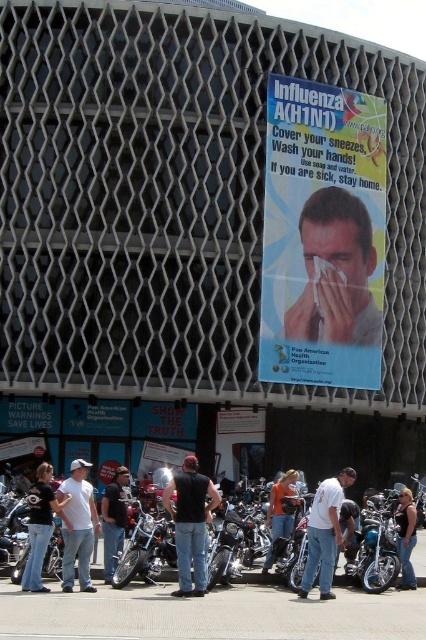
Between white cotton shirt at lower left and denim jeans at lower right, which one appears on the right side from the viewer's perspective?

denim jeans at lower right

Is white cotton shirt at lower left below denim jeans at lower right?

Incorrect, white cotton shirt at lower left is not positioned below denim jeans at lower right.

Is point (91, 544) positioned after point (399, 582)?

No, (91, 544) is closer to viewer.

This screenshot has height=640, width=426. I want to click on white cotton shirt at lower left, so click(77, 525).

Can you confirm if smooth skin face at center is thinner than denim jeans at lower right?

No.

Who is more forward, (333, 232) or (408, 554)?

Point (408, 554) is more forward.

Where is `smooth skin face at center`? This screenshot has height=640, width=426. smooth skin face at center is located at coordinates (336, 273).

Does white cotton shirt at lower left lie behind denim jeans at lower left?

Yes, white cotton shirt at lower left is behind denim jeans at lower left.

Who is lower down, white cotton shirt at lower left or denim jeans at lower left?

denim jeans at lower left

Is point (85, 472) closer to camera compared to point (40, 570)?

That is False.

The height and width of the screenshot is (640, 426). Identify the location of white cotton shirt at lower left. (77, 525).